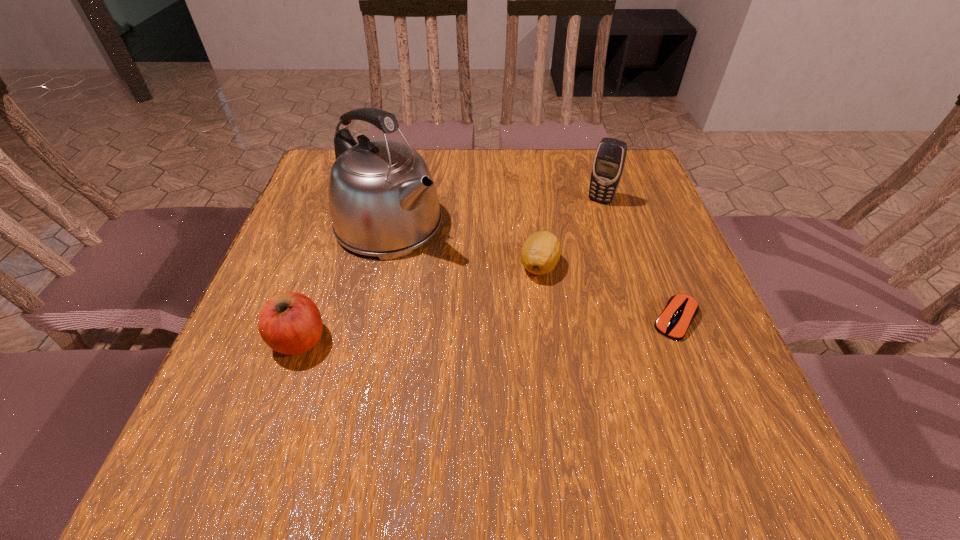
Locate an element on the screen. The width and height of the screenshot is (960, 540). kettle located at the left edge is located at coordinates (383, 202).

This screenshot has width=960, height=540. Find the location of `computer mouse that is at the right edge`. computer mouse that is at the right edge is located at coordinates (681, 309).

I want to click on cellular telephone present at the right edge, so click(x=609, y=161).

Where is `object that is positioned at the far left corner`? This screenshot has height=540, width=960. object that is positioned at the far left corner is located at coordinates (383, 202).

Locate an element on the screen. The image size is (960, 540). object that is positioned at the far right corner is located at coordinates (609, 161).

In the image, there is a desktop. Where is `free space at the far edge`? Image resolution: width=960 pixels, height=540 pixels. free space at the far edge is located at coordinates [x=559, y=181].

In the image, there is a desktop. At what (x,y) coordinates should I click in order to perform the action: click on blank space at the near edge. Please return your answer as a coordinate pair (x, y). Looking at the image, I should click on (582, 422).

This screenshot has width=960, height=540. In order to click on vacant region at the left edge of the desktop in this screenshot , I will do `click(304, 356)`.

Locate an element on the screen. free space at the right edge is located at coordinates (619, 240).

Where is `free point at the far right corner`? This screenshot has height=540, width=960. free point at the far right corner is located at coordinates (590, 150).